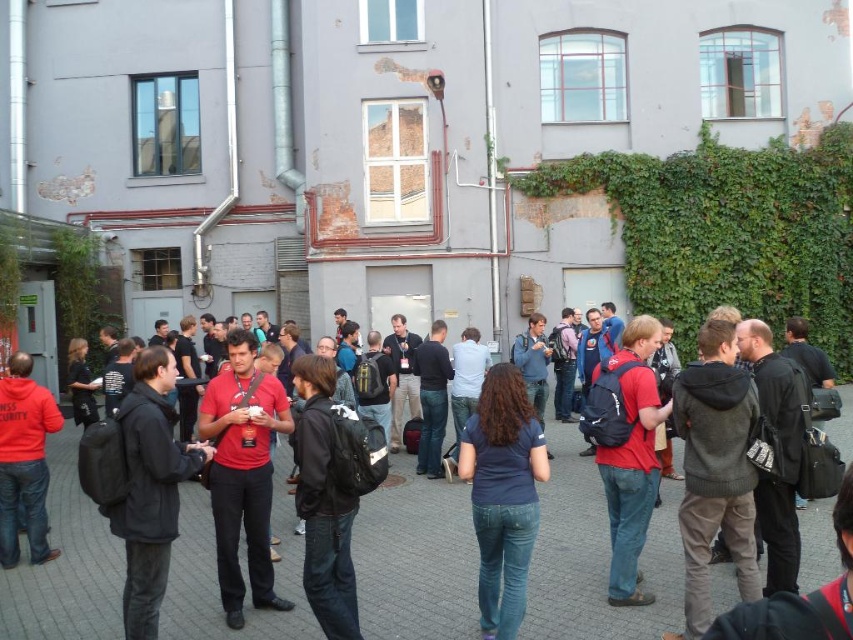
Measure the distance between black backpack at center and green leafy ivy at center right.

black backpack at center and green leafy ivy at center right are 9.05 meters apart from each other.

At what (x,y) coordinates should I click in order to perform the action: click on black backpack at center. Please return your answer as a coordinate pair (x, y). This screenshot has height=640, width=853. Looking at the image, I should click on coord(595,556).

Which is in front, point (96, 577) or point (621, 173)?

Point (96, 577) is in front.

The width and height of the screenshot is (853, 640). Find the location of `black backpack at center`. black backpack at center is located at coordinates (595, 556).